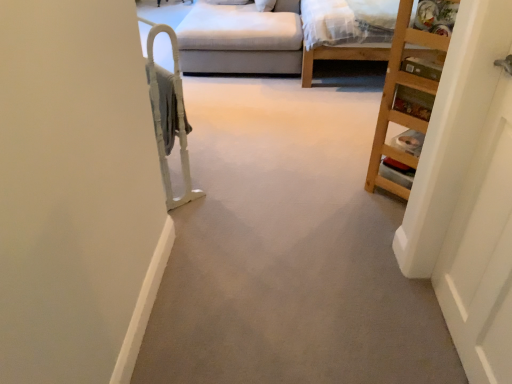
The height and width of the screenshot is (384, 512). What do you see at coordinates (241, 39) in the screenshot?
I see `light beige fabric couch at upper center` at bounding box center [241, 39].

The width and height of the screenshot is (512, 384). I want to click on wooden bed frame at upper right, so click(x=338, y=57).

The width and height of the screenshot is (512, 384). Find the location of `furniture below the white wooden door at right (from a real-world perspective)`. furniture below the white wooden door at right (from a real-world perspective) is located at coordinates (393, 99).

Is the depth of white wooden door at right less than that of wooden bookshelf at right?

Yes, it is.

Is white wooden door at right positioned far away from wooden bookshelf at right?

No, white wooden door at right is in close proximity to wooden bookshelf at right.

You are a GUI agent. You are given a task and a screenshot of the screen. Output one action in this format:
    pyautogui.click(x=<x>, y=<y>)
    Task: Click on the furniture above the wooden bed frame at upper right (from a real-world perspective)
    
    Given the screenshot: What is the action you would take?
    pyautogui.click(x=393, y=99)

Would you consider wooden bookshelf at right to be distant from wooden bed frame at upper right?

Yes, wooden bookshelf at right is far from wooden bed frame at upper right.

Which object is closer to the camera, wooden bookshelf at right or wooden bed frame at upper right?

wooden bookshelf at right is more forward.

Identify the location of furniture located on the left of wooden bed frame at upper right. The height and width of the screenshot is (384, 512). (393, 99).

Relative to wooden bookshelf at right, is wooden bed frame at upper right in front or behind?

In the image, wooden bed frame at upper right appears behind wooden bookshelf at right.

From the picture: Is wooden bed frame at upper right directly adjacent to wooden bookshelf at right?

No, wooden bed frame at upper right is not next to wooden bookshelf at right.

I want to click on studio couch above the wooden bed frame at upper right (from the image's perspective), so click(241, 39).

Between wooden bed frame at upper right and light beige fabric couch at upper center, which one appears on the right side from the viewer's perspective?

wooden bed frame at upper right.

From a real-world perspective, is wooden bed frame at upper right physically below light beige fabric couch at upper center?

No.

Is white wooden door at right looking in the opposite direction of white plastic bunk bed at left?

That's not correct — white wooden door at right is not looking away from white plastic bunk bed at left.

Considering the relative positions of white wooden door at right and white plastic bunk bed at left in the image provided, is white wooden door at right to the right of white plastic bunk bed at left from the viewer's perspective?

Yes, white wooden door at right is to the right of white plastic bunk bed at left.

Is white wooden door at right directly adjacent to white plastic bunk bed at left?

No, white wooden door at right is not in contact with white plastic bunk bed at left.

From the picture: Can you confirm if light beige fabric couch at upper center is smaller than wooden bed frame at upper right?

Yes, light beige fabric couch at upper center is smaller than wooden bed frame at upper right.

Locate an element on the screen. studio couch to the left of wooden bed frame at upper right is located at coordinates (241, 39).

Would you say light beige fabric couch at upper center is a long distance from wooden bed frame at upper right?

No, light beige fabric couch at upper center is in close proximity to wooden bed frame at upper right.

Is light beige fabric couch at upper center positioned with its back to wooden bed frame at upper right?

Absolutely, light beige fabric couch at upper center is directed away from wooden bed frame at upper right.

Considering the relative positions of white plastic bunk bed at left and wooden bed frame at upper right in the image provided, is white plastic bunk bed at left to the right of wooden bed frame at upper right from the viewer's perspective?

Incorrect, white plastic bunk bed at left is not on the right side of wooden bed frame at upper right.

Considering the relative sizes of white plastic bunk bed at left and wooden bed frame at upper right in the image provided, is white plastic bunk bed at left thinner than wooden bed frame at upper right?

Correct, the width of white plastic bunk bed at left is less than that of wooden bed frame at upper right.

Can you confirm if white plastic bunk bed at left is bigger than wooden bed frame at upper right?

Actually, white plastic bunk bed at left might be smaller than wooden bed frame at upper right.

You are a GUI agent. You are given a task and a screenshot of the screen. Output one action in this format:
    pyautogui.click(x=<x>, y=<y>)
    Task: Click on the furniture above the white wooden door at right (from the image's perspective)
    
    Given the screenshot: What is the action you would take?
    pyautogui.click(x=393, y=99)

Identify the location of furniture above the wooden bed frame at upper right (from a real-world perspective). (393, 99).

In the scene shown: Considering their positions, is wooden bed frame at upper right positioned closer to white wooden door at right than light beige fabric couch at upper center?

The object closer to white wooden door at right is wooden bed frame at upper right.

Estimate the real-world distances between objects in this image. Which object is further from wooden bookshelf at right, white plastic bunk bed at left or light beige fabric couch at upper center?

Among the two, light beige fabric couch at upper center is located further to wooden bookshelf at right.

Consider the image. Estimate the real-world distances between objects in this image. Which object is closer to wooden bed frame at upper right, white wooden door at right or white plastic bunk bed at left?

white plastic bunk bed at left is positioned closer to the anchor wooden bed frame at upper right.

From the image, which object appears to be nearer to wooden bed frame at upper right, wooden bookshelf at right or light beige fabric couch at upper center?

light beige fabric couch at upper center is closer to wooden bed frame at upper right.

Estimate the real-world distances between objects in this image. Which object is closer to white plastic bunk bed at left, wooden bed frame at upper right or wooden bookshelf at right?

wooden bookshelf at right is positioned closer to the anchor white plastic bunk bed at left.

Looking at the image, which one is located further to wooden bookshelf at right, white wooden door at right or white plastic bunk bed at left?

white plastic bunk bed at left is positioned further to the anchor wooden bookshelf at right.

When comparing their distances from light beige fabric couch at upper center, does white plastic bunk bed at left or wooden bed frame at upper right seem further?

white plastic bunk bed at left is further to light beige fabric couch at upper center.

Estimate the real-world distances between objects in this image. Which object is further from wooden bed frame at upper right, white wooden door at right or wooden bookshelf at right?

Among the two, white wooden door at right is located further to wooden bed frame at upper right.

Where is `furniture located between white wooden door at right and light beige fabric couch at upper center in the depth direction`? The image size is (512, 384). furniture located between white wooden door at right and light beige fabric couch at upper center in the depth direction is located at coordinates (393, 99).

At what (x,y) coordinates should I click in order to perform the action: click on bed frame between white plastic bunk bed at left and light beige fabric couch at upper center along the z-axis. Please return your answer as a coordinate pair (x, y). Looking at the image, I should click on (338, 57).

You are a GUI agent. You are given a task and a screenshot of the screen. Output one action in this format:
    pyautogui.click(x=<x>, y=<y>)
    Task: Click on the bed frame positioned between wooden bookshelf at right and light beige fabric couch at upper center from near to far
    The width and height of the screenshot is (512, 384).
    Given the screenshot: What is the action you would take?
    pyautogui.click(x=338, y=57)

At what (x,y) coordinates should I click in order to perform the action: click on door located between white plastic bunk bed at left and wooden bookshelf at right in the left-right direction. Please return your answer as a coordinate pair (x, y). Looking at the image, I should click on (480, 201).